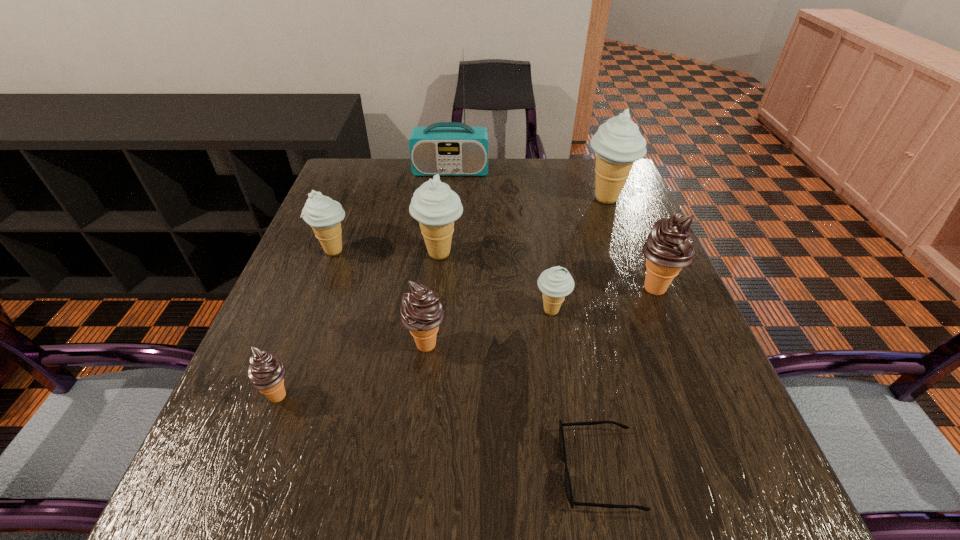
Where is `vacant area located on the back of the leftmost beige icecream`? This screenshot has width=960, height=540. vacant area located on the back of the leftmost beige icecream is located at coordinates (343, 227).

You are a GUI agent. You are given a task and a screenshot of the screen. Output one action in this format:
    pyautogui.click(x=<x>, y=<y>)
    Task: Click on the free region located 0.360m on the right of the second chocolate icecream from left to right
    The width and height of the screenshot is (960, 540).
    Given the screenshot: What is the action you would take?
    pyautogui.click(x=630, y=343)

I want to click on free space located on the front of the third beige icecream from left to right, so click(x=585, y=519).

Where is `free spot located on the front of the leftmost chocolate icecream`? free spot located on the front of the leftmost chocolate icecream is located at coordinates (243, 489).

Where is `vacant space located on the front-facing side of the shortest object`? The image size is (960, 540). vacant space located on the front-facing side of the shortest object is located at coordinates (357, 469).

You are a GUI agent. You are given a task and a screenshot of the screen. Output one action in this format:
    pyautogui.click(x=<x>, y=<y>)
    Task: Click on the free space located 0.120m on the front-facing side of the shortest object
    The height and width of the screenshot is (540, 960).
    Given the screenshot: What is the action you would take?
    pyautogui.click(x=486, y=469)

You are a GUI agent. You are given a task and a screenshot of the screen. Output one action in this format:
    pyautogui.click(x=<x>, y=<y>)
    Task: Click on the free space located on the front-facing side of the shortest object
    The width and height of the screenshot is (960, 540).
    Given the screenshot: What is the action you would take?
    pyautogui.click(x=305, y=469)

Where is `radio receiver present at the far edge`? The image size is (960, 540). radio receiver present at the far edge is located at coordinates (446, 148).

Locate an element on the screen. Image resolution: width=960 pixels, height=540 pixels. icecream that is at the far edge is located at coordinates (618, 143).

This screenshot has width=960, height=540. I want to click on object situated at the near edge, so pos(568,487).